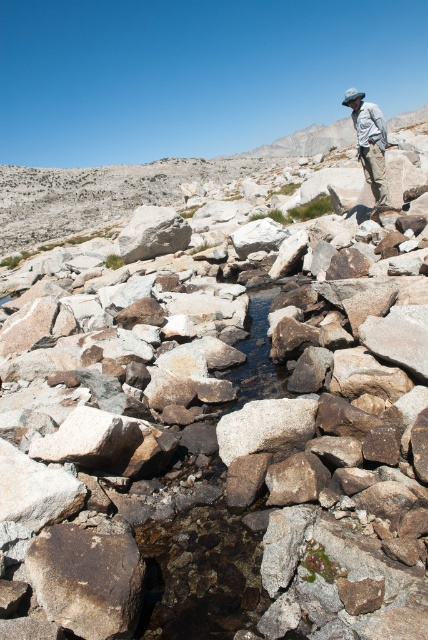
Question: Which of the following is the closest to the observer?

Choices:
 (A) (55, 572)
 (B) (26, 234)
 (C) (140, 227)

Answer: (A)

Question: Can you confirm if smooth granite rocks at center is smaller than light brown fabric hat at upper right?

Choices:
 (A) no
 (B) yes

Answer: (A)

Question: Where is brown rough rock at center located in relation to light brown fabric hat at upper right in the image?

Choices:
 (A) above
 (B) below

Answer: (B)

Question: Estimate the real-world distances between objects in this image. Which object is closer to the light brown fabric hat at upper right?

Choices:
 (A) brown rough rock at center
 (B) smooth granite rocks at center
 (C) gray granite boulder at center
 (D) clear water stream at center

Answer: (D)

Question: Considering the real-world distances, which object is farthest from the smooth granite rocks at center?

Choices:
 (A) light brown fabric hat at upper right
 (B) clear water stream at center
 (C) gray granite boulder at center
 (D) brown rough rock at center

Answer: (A)

Question: Is gray granite boulder at center above light brown fabric hat at upper right?

Choices:
 (A) yes
 (B) no

Answer: (B)